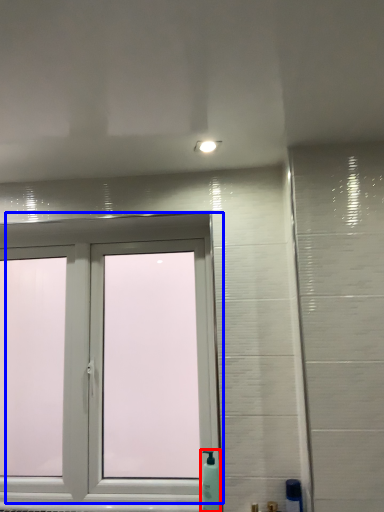
Question: Which point is further to the camera, soap dispenser (highlighted by a red box) or window (highlighted by a blue box)?

Choices:
 (A) soap dispenser
 (B) window

Answer: (B)